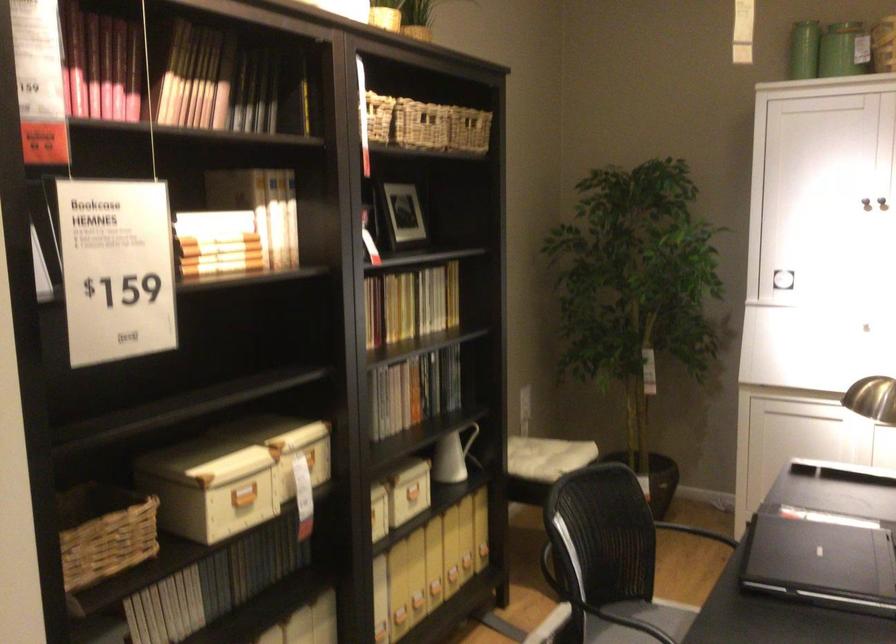
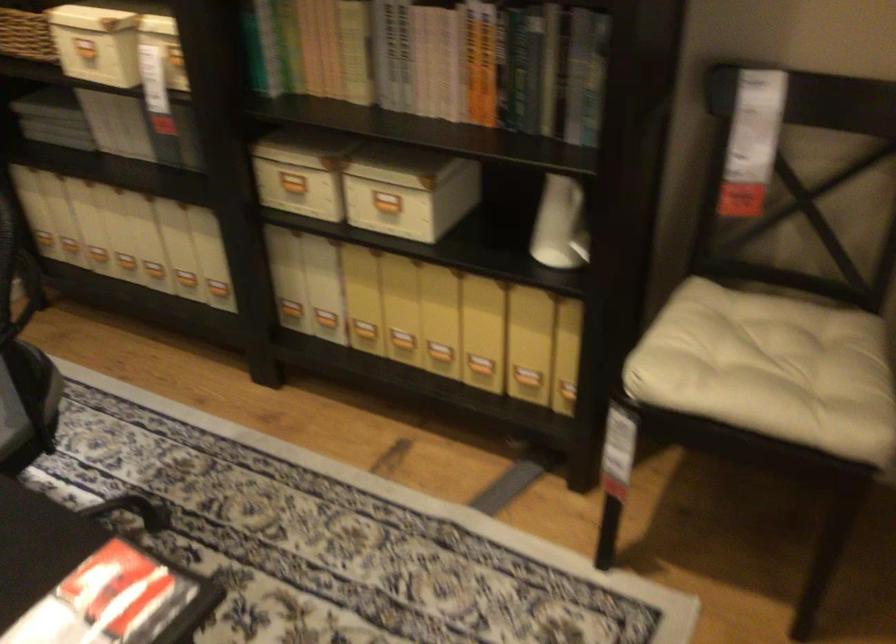
In the second image, find the point that corresponds to pixel 455 466 in the first image.

(582, 238)